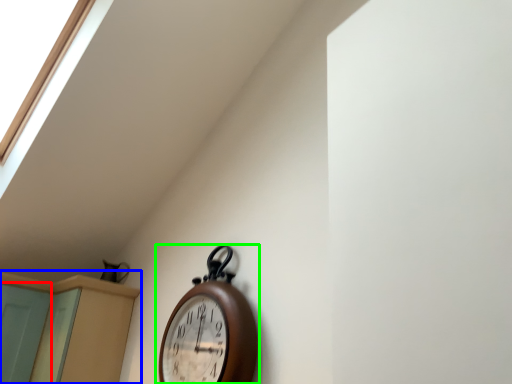
Question: Which object is the farthest from screen door (highlighted by a red box)? Choose among these: dresser (highlighted by a blue box) or wall clock (highlighted by a green box).

Choices:
 (A) dresser
 (B) wall clock

Answer: (B)